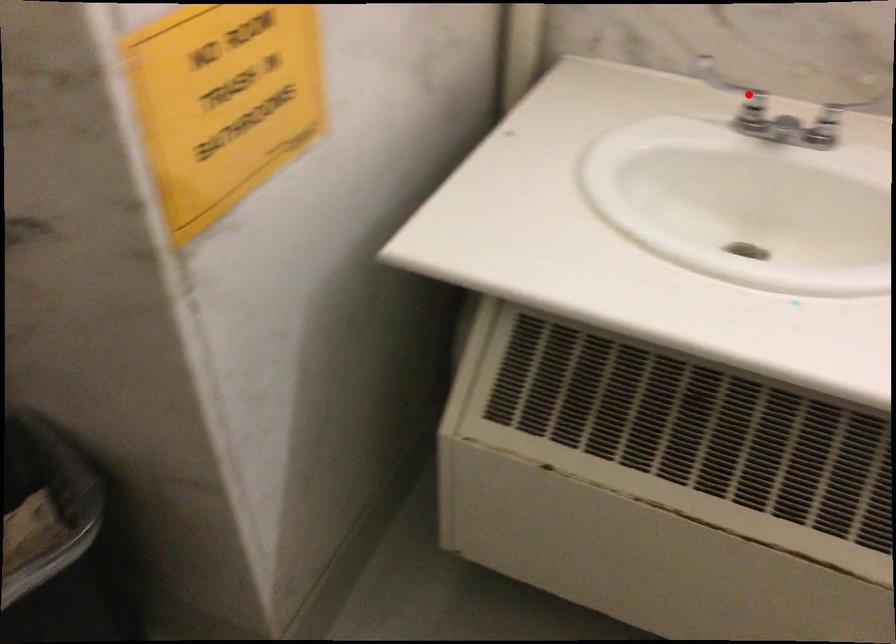
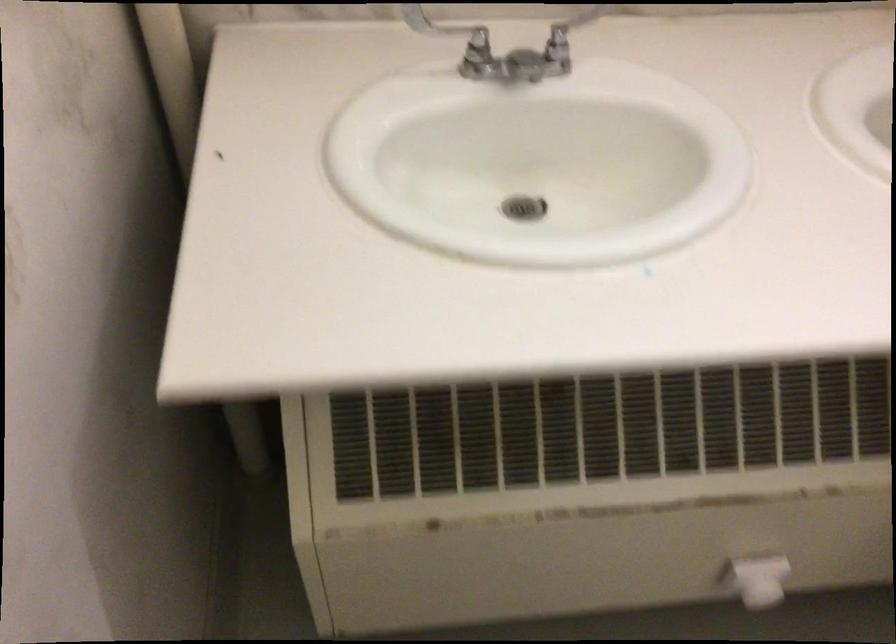
Question: I am providing you with two images of the same scene from different viewpoints. A red point is shown in image1. For the corresponding object point in image2, is it positioned nearer or farther from the camera?

Choices:
 (A) Nearer
 (B) Farther

Answer: (A)